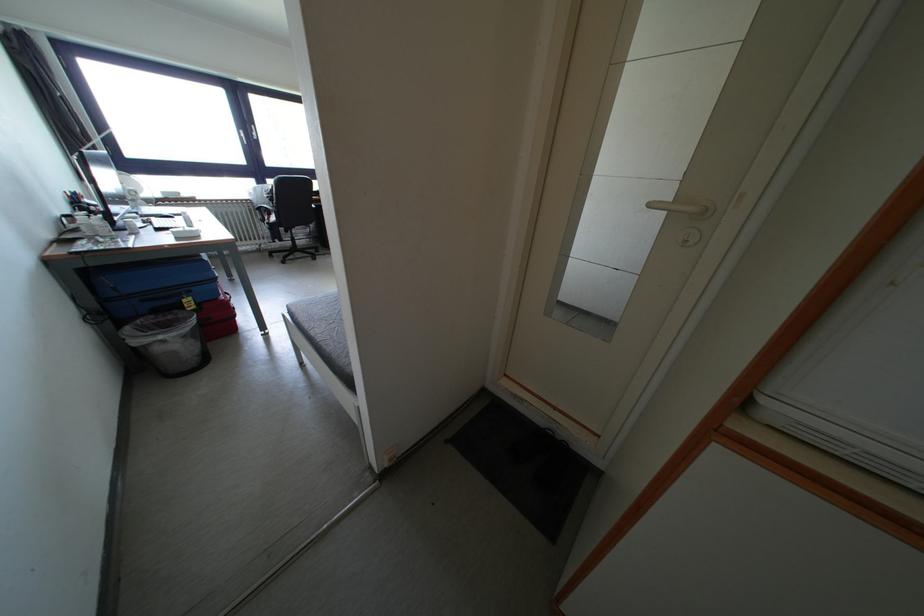
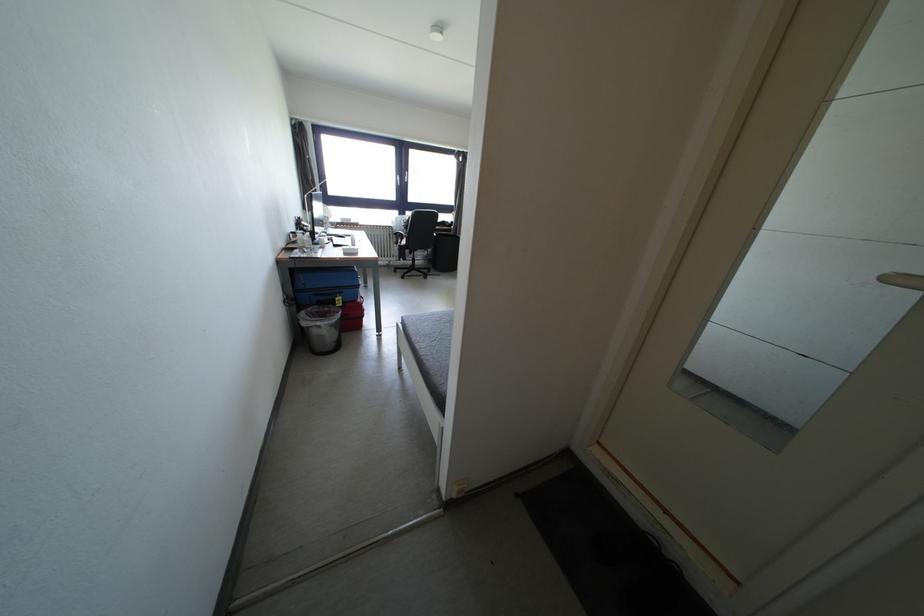
Question: In a continuous first-person perspective shot, in which direction is the camera moving?

Choices:
 (A) Left
 (B) Right
 (C) Forward
 (D) Backward

Answer: (A)